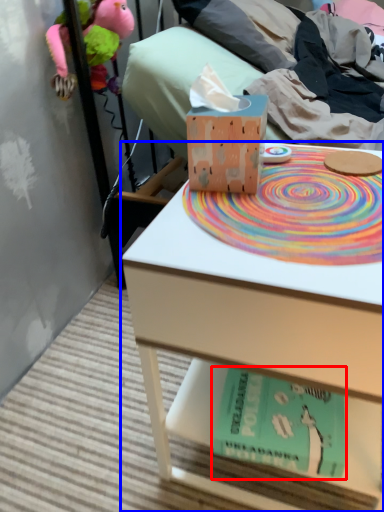
Question: Among these objects, which one is nearest to the camera, paperback book (highlighted by a red box) or table (highlighted by a blue box)?

Choices:
 (A) paperback book
 (B) table

Answer: (B)